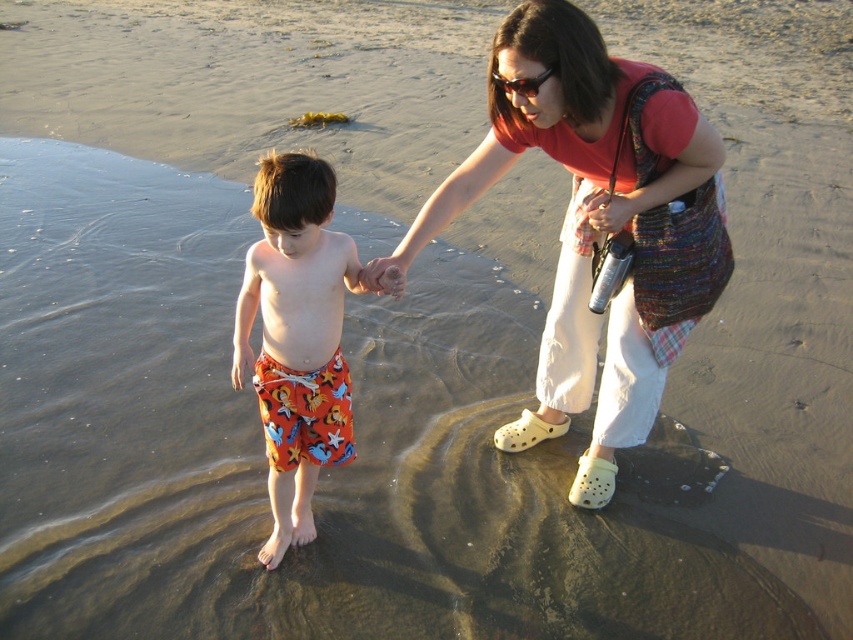
Question: Which point is farther to the camera?

Choices:
 (A) (450, 218)
 (B) (276, 284)

Answer: (A)

Question: Does matte red shirt at center appear over printed swim trunks at center?

Choices:
 (A) yes
 (B) no

Answer: (A)

Question: Does matte red shirt at center lie in front of printed swim trunks at center?

Choices:
 (A) yes
 (B) no

Answer: (A)

Question: Among these objects, which one is nearest to the camera?

Choices:
 (A) printed swim trunks at center
 (B) matte red shirt at center

Answer: (B)

Question: Does matte red shirt at center lie behind printed swim trunks at center?

Choices:
 (A) yes
 (B) no

Answer: (B)